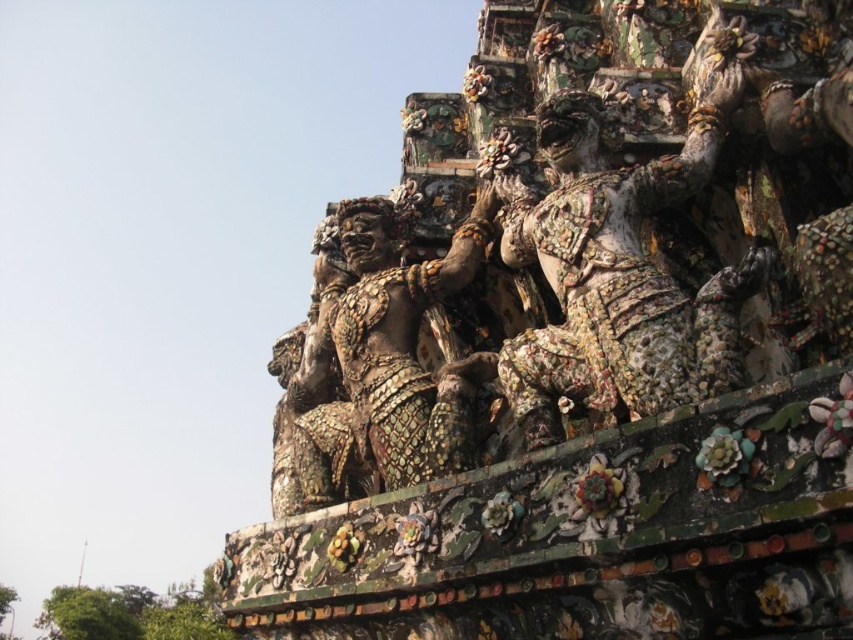
You are an architect examining the upper part of this temple structure. You notice the multicolored mosaic warrior at center and the gold mosaic statue at center. Which of these two figures is shorter in height?

The multicolored mosaic warrior at center is shorter in height compared to the gold mosaic statue at center.

You are an art restorer examining the upper portion of this temple structure. You notice two central figures, the multicolored mosaic warrior at center and the gold mosaic statue at center. Which one would you need to adjust first if you want to start working on the figure that is nearest to you?

The multicolored mosaic warrior at center is closer to the viewer than the gold mosaic statue at center, so you should adjust the multicolored mosaic warrior at center first.

You are an art restorer examining the upper portion of this temple structure. You need to assess the positioning of the multicolored mosaic warrior at center and the gold mosaic statue at center. Which of these two figures is positioned more to the right side of the structure?

The multicolored mosaic warrior at center is positioned more to the right side of the structure compared to the gold mosaic statue at center.